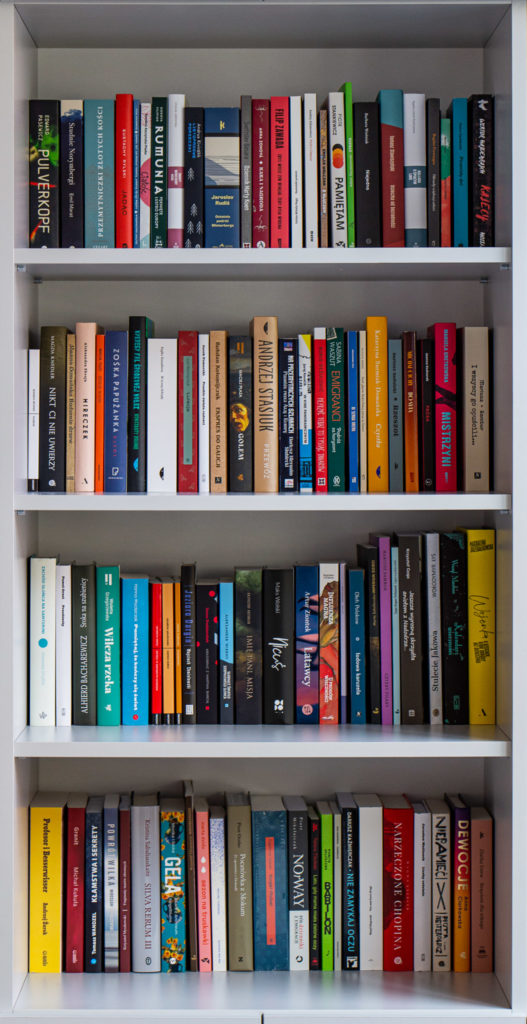
Locate an element on the screen. The image size is (527, 1024). four shelves is located at coordinates (292, 251), (311, 501), (280, 740), (306, 1004).